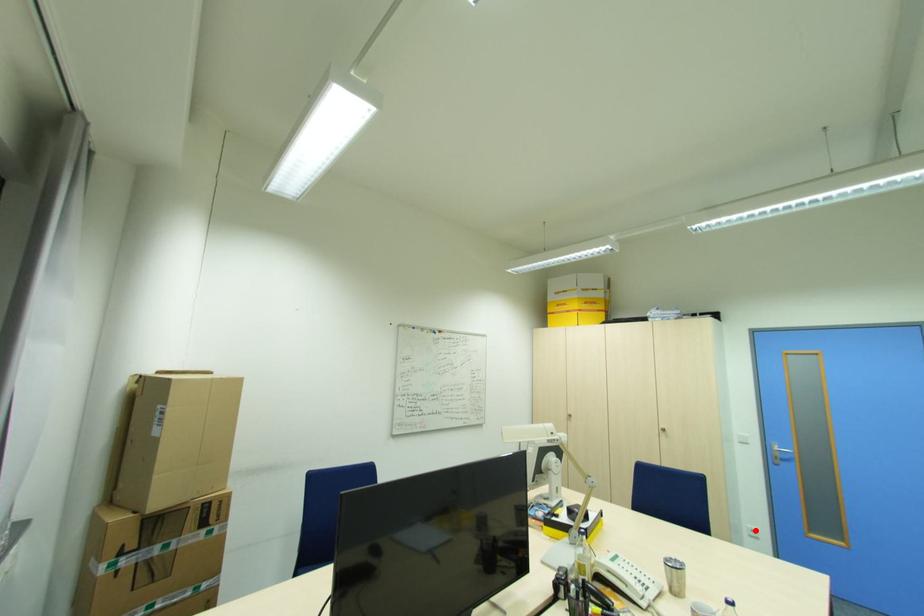
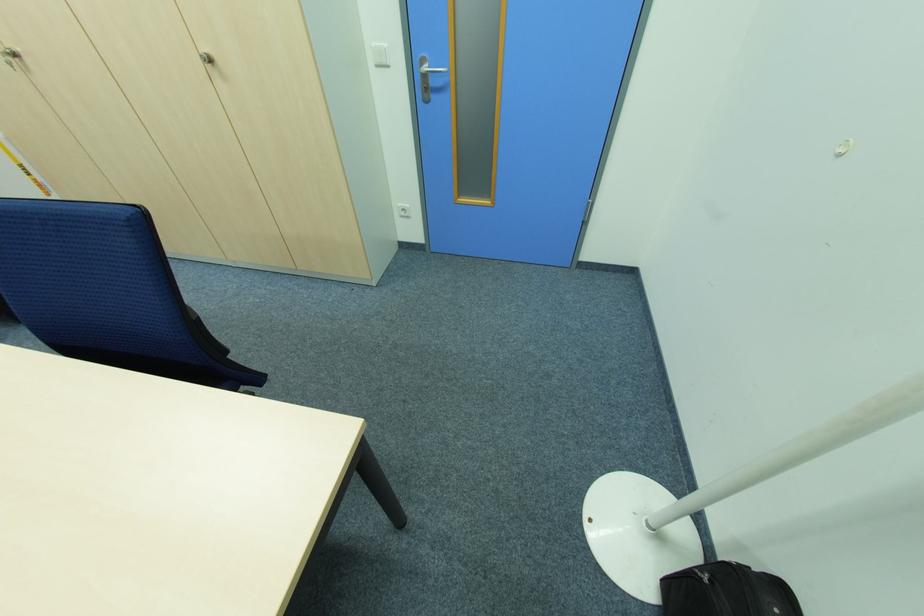
In the second image, find the point that corresponds to the highlighted location in the first image.

(407, 209)